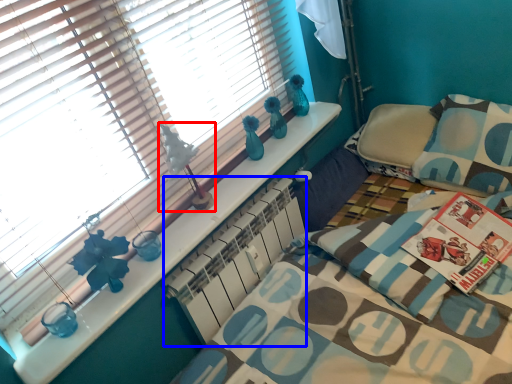
Question: Which of the following is the farthest to the observer, table lamp (highlighted by a red box) or radiator (highlighted by a blue box)?

Choices:
 (A) table lamp
 (B) radiator

Answer: (B)